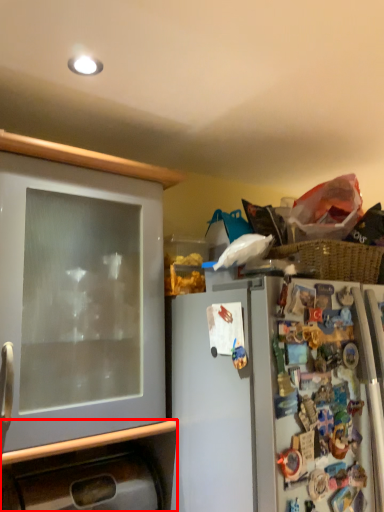
Question: Where is cabinetry (annotated by the red box) located in relation to cabinetry in the image?

Choices:
 (A) left
 (B) right

Answer: (B)